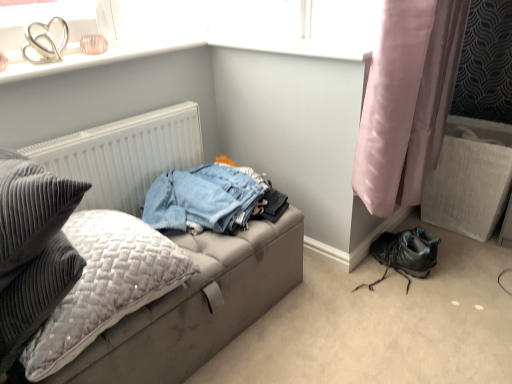
Where is `vacant region to the left of matte black shoe at lower right`? vacant region to the left of matte black shoe at lower right is located at coordinates 322,291.